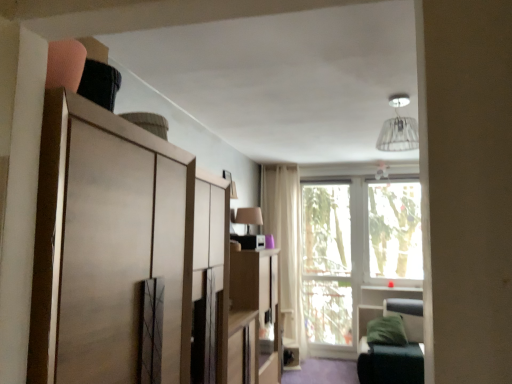
Question: Could you tell me if white fabric lampshade at upper center is facing wooden cabinet at center, the second cabinetry viewed from the left?

Choices:
 (A) yes
 (B) no

Answer: (B)

Question: Is white fabric lampshade at upper center far away from wooden cabinet at center, marked as the 2th cabinetry in a top-to-bottom arrangement?

Choices:
 (A) no
 (B) yes

Answer: (B)

Question: Is white fabric lampshade at upper center thinner than wooden cabinet at center, positioned as the first cabinetry in right-to-left order?

Choices:
 (A) yes
 (B) no

Answer: (A)

Question: Is the position of white fabric lampshade at upper center less distant than that of wooden cabinet at center, marked as the 2th cabinetry in a top-to-bottom arrangement?

Choices:
 (A) no
 (B) yes

Answer: (B)

Question: Is white fabric lampshade at upper center facing away from wooden cabinet at center, which is counted as the first cabinetry, starting from the back?

Choices:
 (A) no
 (B) yes

Answer: (A)

Question: In the image, is beige fabric curtain at center on the left side or the right side of matte beige lampshade at upper center?

Choices:
 (A) left
 (B) right

Answer: (B)

Question: From a real-world perspective, relative to matte beige lampshade at upper center, is beige fabric curtain at center vertically above or below?

Choices:
 (A) above
 (B) below

Answer: (B)

Question: In terms of width, does beige fabric curtain at center look wider or thinner when compared to matte beige lampshade at upper center?

Choices:
 (A) thin
 (B) wide

Answer: (A)

Question: From the image's perspective, is beige fabric curtain at center above or below matte beige lampshade at upper center?

Choices:
 (A) below
 (B) above

Answer: (A)

Question: Is point (134, 192) positioned closer to the camera than point (414, 147)?

Choices:
 (A) closer
 (B) farther

Answer: (A)

Question: Would you say matte wood cabinet at upper left, the first cabinetry positioned from the front, is inside or outside white fabric lampshade at upper center?

Choices:
 (A) outside
 (B) inside

Answer: (A)

Question: From a real-world perspective, relative to white fabric lampshade at upper center, is matte wood cabinet at upper left, which is the 1th cabinetry in top-to-bottom order, vertically above or below?

Choices:
 (A) below
 (B) above

Answer: (A)

Question: Considering the positions of matte wood cabinet at upper left, the 2th cabinetry viewed from the back, and white fabric lampshade at upper center in the image, is matte wood cabinet at upper left, the 2th cabinetry viewed from the back, taller or shorter than white fabric lampshade at upper center?

Choices:
 (A) short
 (B) tall

Answer: (B)

Question: From the image's perspective, is matte beige lampshade at upper center above or below transparent glass window at center, the first window screen in the left-to-right sequence?

Choices:
 (A) above
 (B) below

Answer: (A)

Question: Is matte beige lampshade at upper center inside or outside of transparent glass window at center, placed as the second window screen when sorted from right to left?

Choices:
 (A) inside
 (B) outside

Answer: (B)